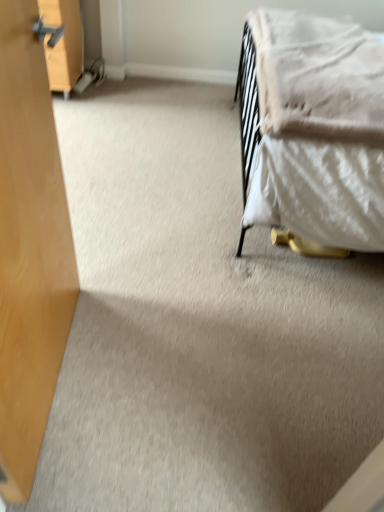
Question: Does wooden drawer at upper left appear on the left side of soft pink quilt at right?

Choices:
 (A) no
 (B) yes

Answer: (B)

Question: Can you confirm if wooden drawer at upper left is smaller than soft pink quilt at right?

Choices:
 (A) no
 (B) yes

Answer: (B)

Question: Is wooden drawer at upper left thinner than soft pink quilt at right?

Choices:
 (A) yes
 (B) no

Answer: (A)

Question: Can you see wooden drawer at upper left touching soft pink quilt at right?

Choices:
 (A) no
 (B) yes

Answer: (A)

Question: Is soft pink quilt at right a part of wooden drawer at upper left?

Choices:
 (A) no
 (B) yes

Answer: (A)

Question: Does wooden drawer at upper left have a greater height compared to soft pink quilt at right?

Choices:
 (A) no
 (B) yes

Answer: (B)

Question: Is soft pink quilt at right thinner than wooden drawer at upper left?

Choices:
 (A) yes
 (B) no

Answer: (B)

Question: Is soft pink quilt at right outside wooden drawer at upper left?

Choices:
 (A) yes
 (B) no

Answer: (A)

Question: Does soft pink quilt at right lie in front of wooden drawer at upper left?

Choices:
 (A) no
 (B) yes

Answer: (B)

Question: Considering the relative sizes of soft pink quilt at right and wooden drawer at upper left in the image provided, is soft pink quilt at right smaller than wooden drawer at upper left?

Choices:
 (A) yes
 (B) no

Answer: (B)

Question: Are soft pink quilt at right and wooden drawer at upper left far apart?

Choices:
 (A) no
 (B) yes

Answer: (B)

Question: Can you see soft pink quilt at right touching wooden drawer at upper left?

Choices:
 (A) no
 (B) yes

Answer: (A)

Question: Do you think soft pink quilt at right is within wooden drawer at upper left, or outside of it?

Choices:
 (A) outside
 (B) inside

Answer: (A)